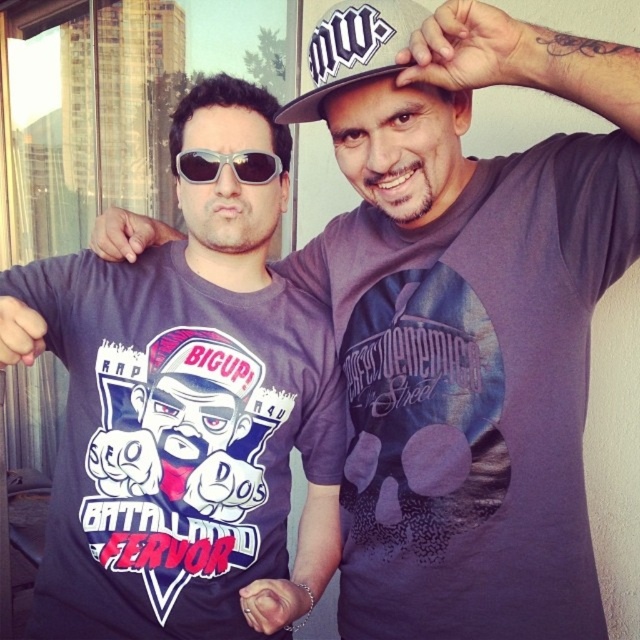
Is point (262, 218) farther from camera compared to point (355, 76)?

Yes, it is behind point (355, 76).

Is matte gray t-shirt at center below white textured baseball cap at upper center?

Indeed, matte gray t-shirt at center is positioned under white textured baseball cap at upper center.

At what (x,y) coordinates should I click in order to perform the action: click on matte gray t-shirt at center. Please return your answer as a coordinate pair (x, y). The image size is (640, 640). Looking at the image, I should click on (186, 410).

Is point (362, 76) in front of point (209, 179)?

Yes, point (362, 76) is closer to viewer.

Does white textured baseball cap at upper center have a lesser width compared to sunglasses at center?

Incorrect, white textured baseball cap at upper center's width is not less than sunglasses at center's.

Identify the location of white textured baseball cap at upper center. (353, 49).

Where is `white textured baseball cap at upper center`? white textured baseball cap at upper center is located at coordinates coord(353,49).

Does matte gray t-shirt at center have a lesser width compared to sunglasses at center?

No.

This screenshot has width=640, height=640. What do you see at coordinates (186, 410) in the screenshot?
I see `matte gray t-shirt at center` at bounding box center [186, 410].

Is point (300, 348) positioned in front of point (240, 164)?

No.

You are a GUI agent. You are given a task and a screenshot of the screen. Output one action in this format:
    pyautogui.click(x=<x>, y=<y>)
    Task: Click on the matte gray t-shirt at center
    The height and width of the screenshot is (640, 640).
    Given the screenshot: What is the action you would take?
    pyautogui.click(x=186, y=410)